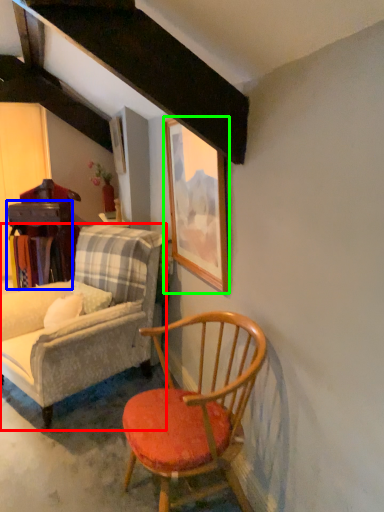
Question: Which object is positioned closest to chair (highlighted by a red box)? Select from table (highlighted by a blue box) and picture frame (highlighted by a green box).

Choices:
 (A) table
 (B) picture frame

Answer: (B)